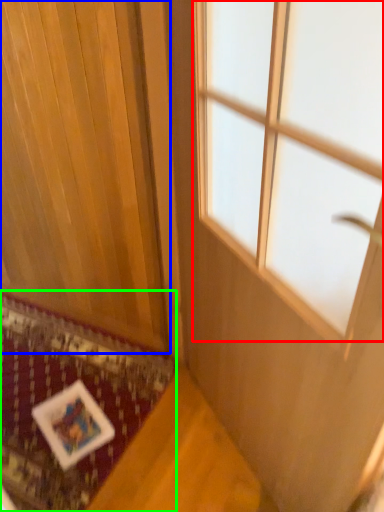
Question: Which object is positioned farthest from window (highlighted by a red box)? Select from curtain (highlighted by a blue box) and mat (highlighted by a green box).

Choices:
 (A) curtain
 (B) mat

Answer: (B)